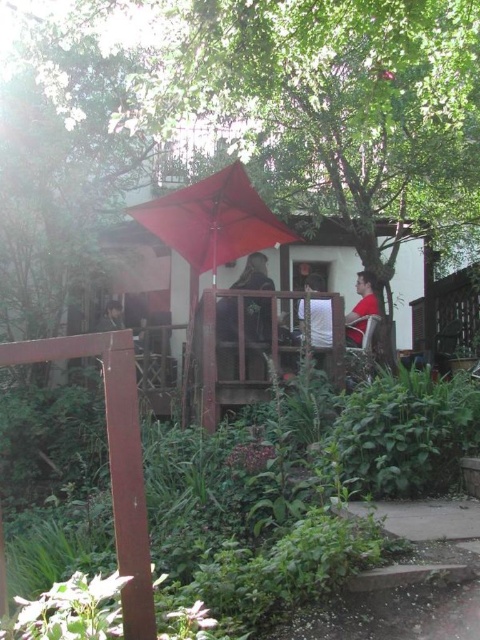
Which is more to the left, dark gray fabric jacket at center or dark gray jacket at lower left?

Positioned to the left is dark gray jacket at lower left.

Is dark gray fabric jacket at center wider than dark gray jacket at lower left?

Yes, dark gray fabric jacket at center is wider than dark gray jacket at lower left.

Does point (254, 285) come behind point (99, 317)?

No, it is not.

Locate an element on the screen. Image resolution: width=480 pixels, height=640 pixels. dark gray fabric jacket at center is located at coordinates (257, 321).

The height and width of the screenshot is (640, 480). Identify the location of green leafy tree at upper center. coord(325,106).

Which is behind, point (317, 280) or point (117, 321)?

The point (317, 280) is more distant.

This screenshot has width=480, height=640. What are the coordinates of `white fabric at center` in the screenshot? It's located at (321, 323).

Image resolution: width=480 pixels, height=640 pixels. I want to click on white fabric at center, so click(x=321, y=323).